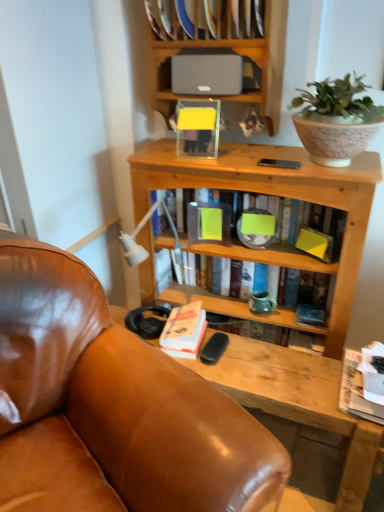
Locate an element on the screen. This screenshot has height=512, width=384. white matte book at center, the 2th book when ordered from bottom to top is located at coordinates (184, 331).

The image size is (384, 512). Describe the element at coordinates (225, 305) in the screenshot. I see `hardcover book at center, acting as the 2th book starting from the top` at that location.

At what (x,y) coordinates should I click in order to perform the action: click on matte gray speaker at upper center. Please return your answer as a coordinate pair (x, y). Looking at the image, I should click on point(225,47).

In the scene shown: Is brown leather chair at center surrounding hardcover book at center, marked as the 3th book in a bottom-to-top arrangement?

No, hardcover book at center, marked as the 3th book in a bottom-to-top arrangement, is not surrounded by brown leather chair at center.

How many degrees apart are the facing directions of brown leather chair at center and hardcover book at center, acting as the 2th book starting from the top?

The facing directions of brown leather chair at center and hardcover book at center, acting as the 2th book starting from the top, are 54 degrees apart.

Identify the location of chair in front of the hardcover book at center, marked as the 3th book in a bottom-to-top arrangement. The height and width of the screenshot is (512, 384). (111, 407).

Looking at their sizes, would you say brown leather chair at center is wider or thinner than hardcover book at center, acting as the 2th book starting from the top?

Clearly, brown leather chair at center has more width compared to hardcover book at center, acting as the 2th book starting from the top.

From the image's perspective, between matte green book at center, which is the first book from top to bottom, and satin gray speaker at upper center, which one is located above?

satin gray speaker at upper center appears higher in the image.

Is the position of matte green book at center, which is the fourth book from bottom to top, more distant than that of satin gray speaker at upper center?

Yes, it is behind satin gray speaker at upper center.

Considering the sizes of objects satin gray speaker at upper center and hardcover book at center, acting as the 2th book starting from the top, in the image provided, who is smaller, satin gray speaker at upper center or hardcover book at center, acting as the 2th book starting from the top,?

With smaller size is satin gray speaker at upper center.

In terms of height, does satin gray speaker at upper center look taller or shorter compared to hardcover book at center, acting as the 2th book starting from the top?

In the image, satin gray speaker at upper center appears to be shorter than hardcover book at center, acting as the 2th book starting from the top.

From a real-world perspective, is satin gray speaker at upper center beneath hardcover book at center, acting as the 2th book starting from the top?

No, from a real-world perspective, satin gray speaker at upper center is not under hardcover book at center, acting as the 2th book starting from the top.

Which object is positioned more to the right, satin gray speaker at upper center or matte green book at center, which is the fourth book from bottom to top?

matte green book at center, which is the fourth book from bottom to top.

Is satin gray speaker at upper center positioned behind matte green book at center, which is the first book from top to bottom?

No, satin gray speaker at upper center is in front of matte green book at center, which is the first book from top to bottom.

From a real-world perspective, is satin gray speaker at upper center physically below matte green book at center, which is the fourth book from bottom to top?

No, from a real-world perspective, satin gray speaker at upper center is not under matte green book at center, which is the fourth book from bottom to top.

Which is behind, point (161, 112) or point (357, 410)?

The point (161, 112) is more distant.

Which object is further away from the camera, matte gray speaker at upper center or white paper at lower right, the 1th book positioned from the bottom?

matte gray speaker at upper center.

Is matte gray speaker at upper center oriented towards white paper at lower right, placed as the 4th book when sorted from top to bottom?

No, matte gray speaker at upper center is not turned towards white paper at lower right, placed as the 4th book when sorted from top to bottom.

Which of these two, matte gray speaker at upper center or white paper at lower right, the 1th book positioned from the bottom, is smaller?

With smaller size is white paper at lower right, the 1th book positioned from the bottom.

At what (x,y) coordinates should I click in order to perform the action: click on the 1st book behind the satin gray speaker at upper center. Please return your answer as a coordinate pair (x, y). Looking at the image, I should click on (184, 331).

Can you confirm if white matte book at center, the third book when ordered from top to bottom, is smaller than satin gray speaker at upper center?

Correct, white matte book at center, the third book when ordered from top to bottom, occupies less space than satin gray speaker at upper center.

Is white matte book at center, the third book when ordered from top to bottom, situated inside satin gray speaker at upper center or outside?

white matte book at center, the third book when ordered from top to bottom, cannot be found inside satin gray speaker at upper center.

From the image's perspective, is white matte book at center, the 2th book when ordered from bottom to top, located above or below satin gray speaker at upper center?

Based on their image positions, white matte book at center, the 2th book when ordered from bottom to top, is located beneath satin gray speaker at upper center.

Is white paper at lower right, placed as the 4th book when sorted from top to bottom, behind white matte book at center, the 2th book when ordered from bottom to top?

No, white paper at lower right, placed as the 4th book when sorted from top to bottom, is closer to the viewer.

Is white paper at lower right, the 1th book positioned from the bottom, completely or partially outside of white matte book at center, the 2th book when ordered from bottom to top?

white paper at lower right, the 1th book positioned from the bottom, is positioned outside white matte book at center, the 2th book when ordered from bottom to top.

Could you tell me if white paper at lower right, the 1th book positioned from the bottom, is facing white matte book at center, the 2th book when ordered from bottom to top?

No, white paper at lower right, the 1th book positioned from the bottom, is not aimed at white matte book at center, the 2th book when ordered from bottom to top.

Between white paper at lower right, placed as the 4th book when sorted from top to bottom, and white matte book at center, the third book when ordered from top to bottom, which one has larger size?

white paper at lower right, placed as the 4th book when sorted from top to bottom.

Find the location of a particular element. This screenshot has width=384, height=512. chair in front of the hardcover book at center, acting as the 2th book starting from the top is located at coordinates (111, 407).

Which book is the 2nd one when counting from the back of the satin gray speaker at upper center? Please provide its 2D coordinates.

[(264, 255)]

Considering their positions, is white matte book at center, the 2th book when ordered from bottom to top, positioned further to matte green book at center, which is the first book from top to bottom, than brown leather chair at center?

brown leather chair at center lies further to matte green book at center, which is the first book from top to bottom, than the other object.

When comparing their distances from white matte book at center, the third book when ordered from top to bottom, does matte green book at center, which is the first book from top to bottom, or satin gray speaker at upper center seem further?

Among the two, satin gray speaker at upper center is located further to white matte book at center, the third book when ordered from top to bottom.

Looking at this image, from the image, which object appears to be farther from matte gray speaker at upper center, satin gray speaker at upper center or white paper at lower right, placed as the 4th book when sorted from top to bottom?

white paper at lower right, placed as the 4th book when sorted from top to bottom, lies further to matte gray speaker at upper center than the other object.

Looking at the image, which one is located further to matte gray speaker at upper center, white matte book at center, the third book when ordered from top to bottom, or matte green book at center, which is the fourth book from bottom to top?

The object further to matte gray speaker at upper center is white matte book at center, the third book when ordered from top to bottom.

Estimate the real-world distances between objects in this image. Which object is further from matte gray speaker at upper center, white matte book at center, the third book when ordered from top to bottom, or brown leather chair at center?

Based on the image, brown leather chair at center appears to be further to matte gray speaker at upper center.

Considering their positions, is matte gray speaker at upper center positioned further to matte green book at center, which is the fourth book from bottom to top, than brown leather chair at center?

brown leather chair at center is positioned further to the anchor matte green book at center, which is the fourth book from bottom to top.

Which object lies nearer to the anchor point hardcover book at center, marked as the 3th book in a bottom-to-top arrangement, brown leather chair at center or white paper at lower right, the 1th book positioned from the bottom?

white paper at lower right, the 1th book positioned from the bottom, lies closer to hardcover book at center, marked as the 3th book in a bottom-to-top arrangement, than the other object.

When comparing their distances from brown leather chair at center, does white matte book at center, the third book when ordered from top to bottom, or satin gray speaker at upper center seem further?

satin gray speaker at upper center.

Identify the location of shelf that lies between matte gray speaker at upper center and brown leather chair at center from top to bottom. This screenshot has width=384, height=512. (211, 71).

Identify the location of book between matte gray speaker at upper center and hardcover book at center, marked as the 3th book in a bottom-to-top arrangement, in the vertical direction. This screenshot has height=512, width=384. (264, 255).

You are a GUI agent. You are given a task and a screenshot of the screen. Output one action in this format:
    pyautogui.click(x=<x>, y=<y>)
    Task: Click on the shelf positioned between brown leather chair at center and matte green book at center, which is the first book from top to bottom, from near to far
    This screenshot has width=384, height=512.
    Given the screenshot: What is the action you would take?
    pyautogui.click(x=211, y=71)

Where is `shelf between brown leather chair at center and hardcover book at center, acting as the 2th book starting from the top, in the front-back direction`? The image size is (384, 512). shelf between brown leather chair at center and hardcover book at center, acting as the 2th book starting from the top, in the front-back direction is located at coordinates (211, 71).